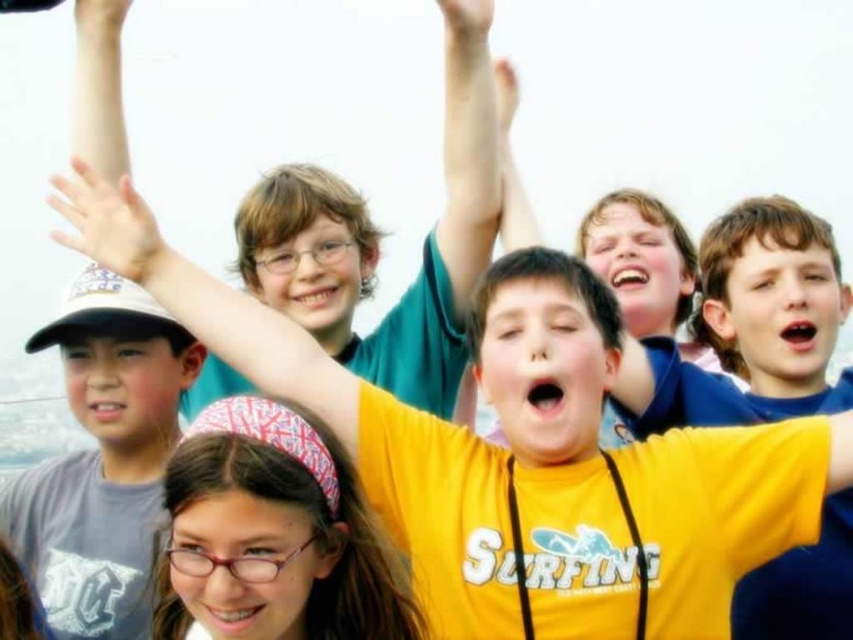
Question: Which object is closer to the camera taking this photo?

Choices:
 (A) yellow matte shirt at center
 (B) matte skin hand at upper left
 (C) gray cotton t-shirt at left

Answer: (A)

Question: Does matte skin arm at upper center appear on the left side of white matte hand at upper center?

Choices:
 (A) yes
 (B) no

Answer: (B)

Question: In this image, where is white matte hand at upper left located relative to matte skin hand at upper center?

Choices:
 (A) above
 (B) below

Answer: (B)

Question: Which of the following is the closest to the observer?

Choices:
 (A) gray cotton t-shirt at left
 (B) matte skin hand at upper center
 (C) matte skin arm at upper center

Answer: (A)

Question: Which object appears closest to the camera in this image?

Choices:
 (A) matte skin hand at upper center
 (B) matte skin hand at upper left

Answer: (A)

Question: Considering the relative positions of yellow matte shirt at center and matte skin hand at upper left in the image provided, where is yellow matte shirt at center located with respect to matte skin hand at upper left?

Choices:
 (A) right
 (B) left

Answer: (A)